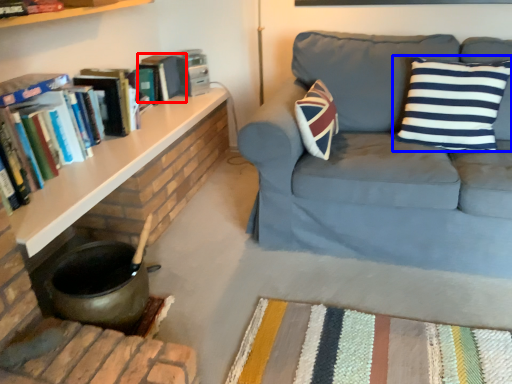
Question: Which object appears farthest to the camera in this image, paperback book (highlighted by a red box) or pillow (highlighted by a blue box)?

Choices:
 (A) paperback book
 (B) pillow

Answer: (A)